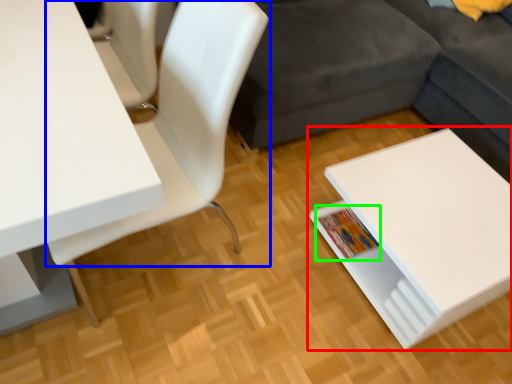
Question: Which object is positioned closest to table (highlighted by a red box)? Select from chair (highlighted by a blue box) and book (highlighted by a green box).

Choices:
 (A) chair
 (B) book

Answer: (B)